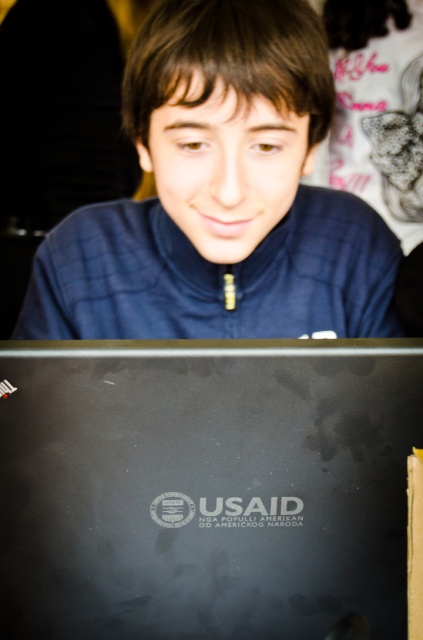
Question: Is black matte laptop at lower center wider than matte blue jacket at center?

Choices:
 (A) no
 (B) yes

Answer: (A)

Question: Does black matte laptop at lower center have a greater width compared to matte blue jacket at center?

Choices:
 (A) yes
 (B) no

Answer: (B)

Question: Is black matte laptop at lower center wider than matte blue jacket at center?

Choices:
 (A) no
 (B) yes

Answer: (A)

Question: Among these objects, which one is farthest from the camera?

Choices:
 (A) matte blue jacket at center
 (B) black matte laptop at lower center

Answer: (A)

Question: Which point appears farthest from the camera in this image?

Choices:
 (A) (315, 76)
 (B) (368, 456)

Answer: (A)